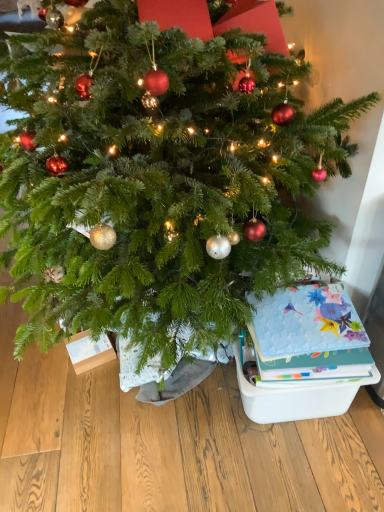
Question: From a real-world perspective, is matte plastic storage box at lower right positioned above or below floral paper card at lower right?

Choices:
 (A) below
 (B) above

Answer: (A)

Question: Is point (332, 398) closer or farther from the camera than point (317, 344)?

Choices:
 (A) farther
 (B) closer

Answer: (A)

Question: From the image's perspective, is matte plastic storage box at lower right located above or below floral paper card at lower right?

Choices:
 (A) above
 (B) below

Answer: (B)

Question: Considering their positions, is floral paper card at lower right located in front of or behind matte plastic storage box at lower right?

Choices:
 (A) front
 (B) behind

Answer: (A)

Question: Considering the relative positions of floral paper card at lower right and matte plastic storage box at lower right in the image provided, is floral paper card at lower right to the left or to the right of matte plastic storage box at lower right?

Choices:
 (A) left
 (B) right

Answer: (A)

Question: Is floral paper card at lower right taller or shorter than matte plastic storage box at lower right?

Choices:
 (A) short
 (B) tall

Answer: (A)

Question: Is point (354, 323) closer or farther from the camera than point (240, 391)?

Choices:
 (A) farther
 (B) closer

Answer: (B)